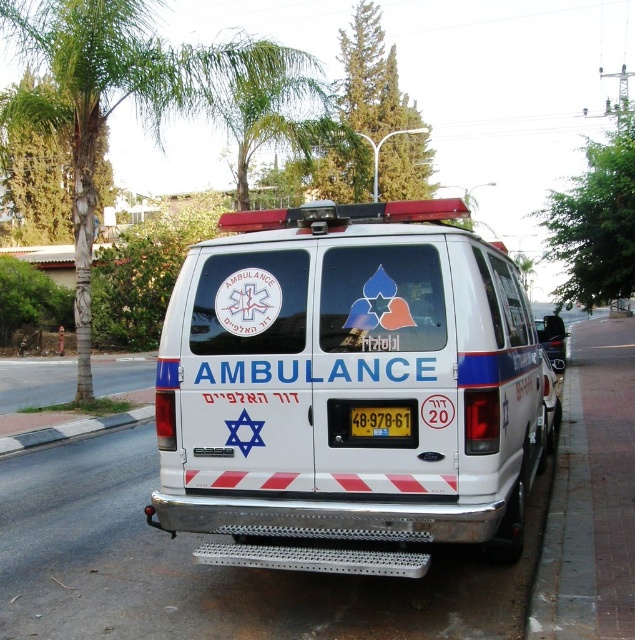
Question: Can you confirm if white glossy ambulance at center is bigger than yellow metallic license plate at center?

Choices:
 (A) yes
 (B) no

Answer: (A)

Question: Observing the image, what is the correct spatial positioning of white glossy ambulance at center in reference to glossy black mirror at right?

Choices:
 (A) below
 (B) above

Answer: (A)

Question: Estimate the real-world distances between objects in this image. Which object is farther from the white glossy ambulance at center?

Choices:
 (A) gray concrete curb at lower left
 (B) glossy black mirror at right

Answer: (B)

Question: Considering the real-world distances, which object is farthest from the yellow metallic license plate at center?

Choices:
 (A) gray concrete curb at lower left
 (B) glossy black mirror at right

Answer: (A)

Question: Can you confirm if white glossy ambulance at center is positioned below gray concrete curb at lower left?

Choices:
 (A) yes
 (B) no

Answer: (B)

Question: Which point is farther to the camera?

Choices:
 (A) gray concrete curb at lower left
 (B) yellow metallic license plate at center
 (C) white glossy ambulance at center

Answer: (A)